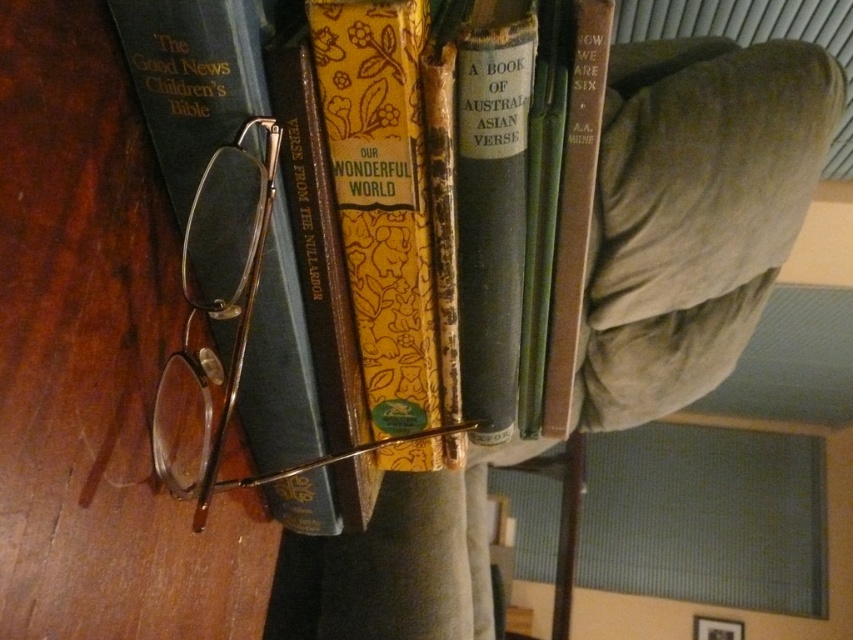
Does yellow paper-covered book at center lie behind hardcover book at left?

Yes, yellow paper-covered book at center is further from the viewer.

Which of these two, yellow paper-covered book at center or hardcover book at left, stands taller?

Standing taller between the two is hardcover book at left.

Is point (410, 164) farther from viewer compared to point (138, 68)?

Yes.

What are the coordinates of `yellow paper-covered book at center` in the screenshot? It's located at 381,196.

Between point (376, 195) and point (592, 124), which one is positioned in front?

Point (592, 124) is more forward.

Which is in front, point (340, 42) or point (590, 129)?

Point (340, 42) is more forward.

Identify the location of yellow paper-covered book at center. (381, 196).

Consider the image. Can you confirm if hardcover book at left is bigger than brown leather book at center?

Yes.

Is point (171, 104) behind point (578, 170)?

No, it is in front of (578, 170).

You are a GUI agent. You are given a task and a screenshot of the screen. Output one action in this format:
    pyautogui.click(x=<x>, y=<y>)
    Task: Click on the hardcover book at left
    Image resolution: width=853 pixels, height=640 pixels.
    Given the screenshot: What is the action you would take?
    pyautogui.click(x=194, y=77)